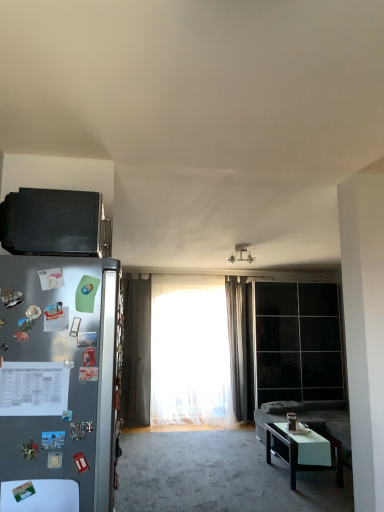
Question: Is black glossy coffee table at lower right closer to the viewer compared to dark gray sheer curtain at center, which is the 2th curtain from left to right?

Choices:
 (A) no
 (B) yes

Answer: (B)

Question: Can you confirm if black glossy coffee table at lower right is shorter than dark gray sheer curtain at center, arranged as the first curtain when viewed from the right?

Choices:
 (A) no
 (B) yes

Answer: (B)

Question: Considering the relative sizes of black glossy coffee table at lower right and dark gray sheer curtain at center, which is the 2th curtain from left to right, in the image provided, is black glossy coffee table at lower right thinner than dark gray sheer curtain at center, which is the 2th curtain from left to right,?

Choices:
 (A) no
 (B) yes

Answer: (A)

Question: Could dark gray sheer curtain at center, arranged as the first curtain when viewed from the right, be considered to be inside black glossy coffee table at lower right?

Choices:
 (A) no
 (B) yes

Answer: (A)

Question: From a real-world perspective, does black glossy coffee table at lower right stand above dark gray sheer curtain at center, which is the 2th curtain from left to right?

Choices:
 (A) no
 (B) yes

Answer: (A)

Question: Is black glossy coffee table at lower right far from dark gray sheer curtain at center, which is the 2th curtain from left to right?

Choices:
 (A) no
 (B) yes

Answer: (B)

Question: Considering the relative positions of black matte microwave at upper left and white glossy table at lower left in the image provided, is black matte microwave at upper left behind white glossy table at lower left?

Choices:
 (A) no
 (B) yes

Answer: (B)

Question: From the image's perspective, is black matte microwave at upper left under white glossy table at lower left?

Choices:
 (A) yes
 (B) no

Answer: (B)

Question: From a real-world perspective, is black matte microwave at upper left beneath white glossy table at lower left?

Choices:
 (A) yes
 (B) no

Answer: (B)

Question: Is white glossy table at lower left surrounded by black matte microwave at upper left?

Choices:
 (A) yes
 (B) no

Answer: (B)

Question: Is black matte microwave at upper left bigger than white glossy table at lower left?

Choices:
 (A) yes
 (B) no

Answer: (A)

Question: Is black matte microwave at upper left at the right side of white glossy table at lower left?

Choices:
 (A) no
 (B) yes

Answer: (A)

Question: Considering the relative sizes of black glossy coffee table at lower right and satin silver refrigerator at left in the image provided, is black glossy coffee table at lower right shorter than satin silver refrigerator at left?

Choices:
 (A) yes
 (B) no

Answer: (A)